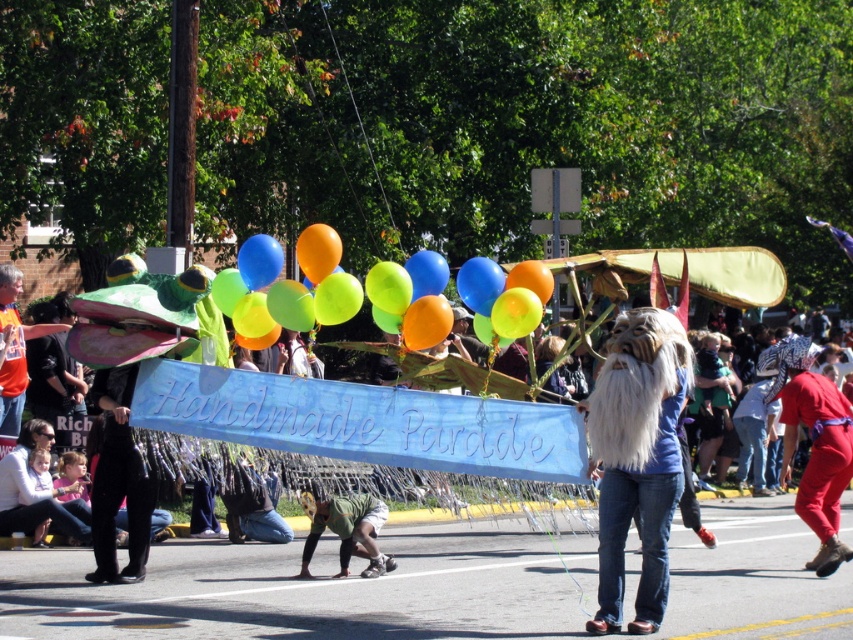
Question: Does white fluffy beard at center lie behind blue rubber balloon at center?

Choices:
 (A) no
 (B) yes

Answer: (A)

Question: Which point is farther to the camera?

Choices:
 (A) green matte shorts at lower center
 (B) red jumpsuit at lower right
 (C) blue rubber balloon at center
 (D) handmade parade banner at center

Answer: (D)

Question: Which of the following is the farthest from the observer?

Choices:
 (A) (819, 406)
 (B) (599, 548)
 (C) (337, 515)

Answer: (A)

Question: Does handmade parade banner at center lie behind green matte shorts at lower center?

Choices:
 (A) yes
 (B) no

Answer: (A)

Question: Is green matte shorts at lower center thinner than orange t-shirt at left?

Choices:
 (A) yes
 (B) no

Answer: (B)

Question: Which object appears farthest from the camera in this image?

Choices:
 (A) green matte shorts at lower center
 (B) handmade parade banner at center
 (C) orange t-shirt at left
 (D) white fluffy beard at center

Answer: (B)